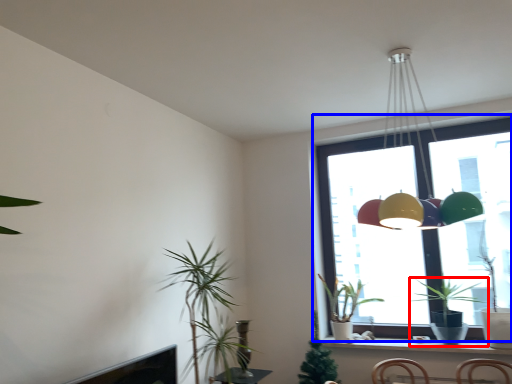
Question: Which point is closer to the camera, houseplant (highlighted by a red box) or window (highlighted by a blue box)?

Choices:
 (A) houseplant
 (B) window

Answer: (A)